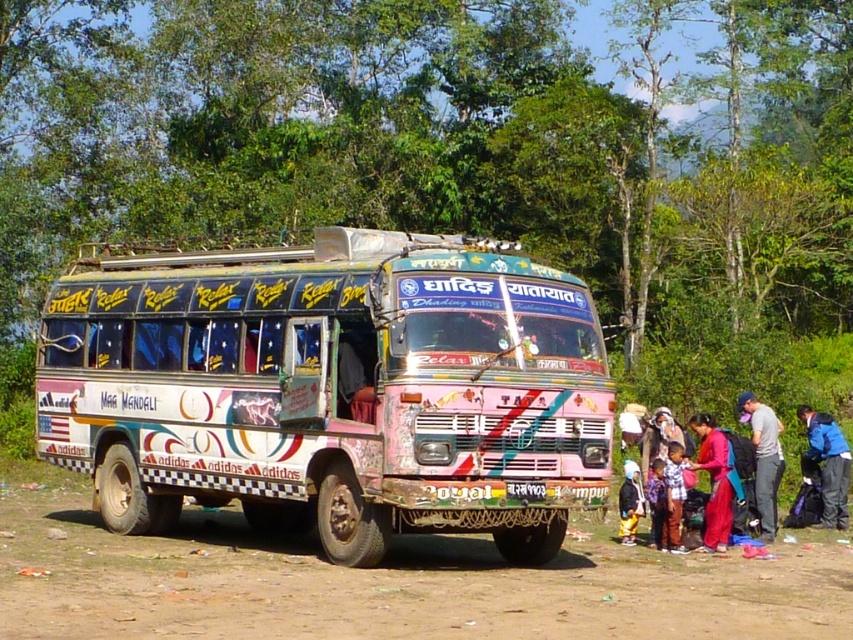
You are standing at the front of the Tata bus and want to find the plaid fabric shirt at lower right. In which direction should you look to see it?

The plaid fabric shirt at lower right is located at point [672,497], which is towards the lower right side of the image from your current position at the front of the bus.